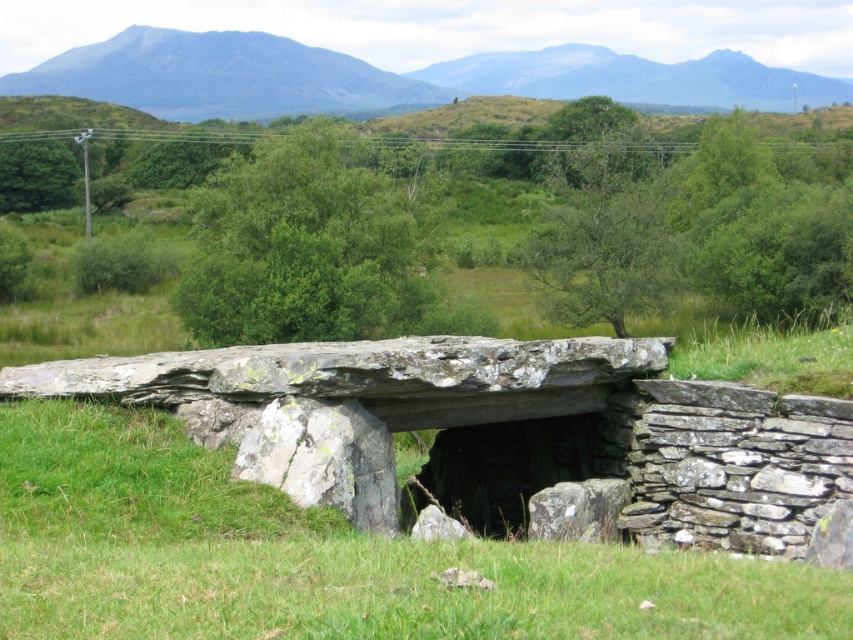
Between green grass at center and gray rock mountain at upper center, which one has less height?

green grass at center is shorter.

Is point (12, 570) positioned before point (775, 86)?

Yes, point (12, 570) is in front of point (775, 86).

Does point (273, 490) lie in front of point (498, 58)?

Yes, point (273, 490) is in front of point (498, 58).

Image resolution: width=853 pixels, height=640 pixels. I want to click on green grass at center, so coord(322,557).

Between green grass at center and blue-green rock formation at upper center, which one appears on the right side from the viewer's perspective?

From the viewer's perspective, green grass at center appears more on the right side.

Is point (207, 481) less distant than point (225, 84)?

Yes, point (207, 481) is closer to viewer.

Locate an element on the screen. The width and height of the screenshot is (853, 640). green grass at center is located at coordinates (322, 557).

Between blue-green rock formation at upper center and gray rock mountain at upper center, which one appears on the left side from the viewer's perspective?

Positioned to the left is blue-green rock formation at upper center.

Can you confirm if blue-green rock formation at upper center is bigger than gray rock mountain at upper center?

Yes, blue-green rock formation at upper center is bigger than gray rock mountain at upper center.

Between point (172, 56) and point (618, 65), which one is positioned in front?

Point (618, 65) is in front.

What are the coordinates of `blue-green rock formation at upper center` in the screenshot? It's located at (219, 76).